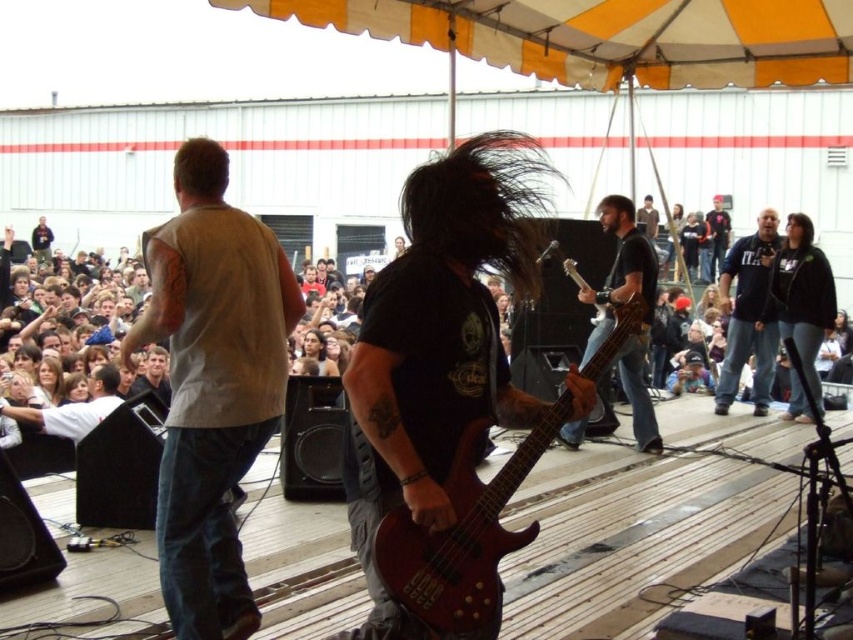
You are a photographer standing at the front of the stage. You want to take a photo that includes both the point at coordinates point (238,436) and point (386,550). Which point should you focus on first to ensure both are in sharp focus?

You should focus on point (238,436) first because it is closer to the camera than point (386,550). This ensures the closer point is in focus, and the farther point will also be within the depth of field.

You are a photographer standing at the camera position. You want to capture a closeup shot of the light brown sleeveless shirt at left. Given that your camera has a maximum zoom range of 5 meters, will you be able to get a clear closeup without moving closer?

The light brown sleeveless shirt at left is 7.22 meters away from camera. Since the camera can only zoom up to 5 meters, you won not be able to get a clear closeup without moving closer.

You are a photographer at the concert and want to capture the bassist and the singer in a single shot. Since the singer is behind the bassist, can you position yourself so that the mahogany wood bass at center is to the right of dark blue jeans at center in the photo?

The mahogany wood bass at center is already to the left of dark blue jeans at center, so positioning yourself to have the bass to the right of the jeans would require moving to the other side of the bassist, but since the singer is behind the bassist, this might not be possible without blocking the view. However, based on the description, the bass is naturally positioned to the left of the jeans, so adjusting the camera angle to frame them differently might be challenging without repositioning the subjects.